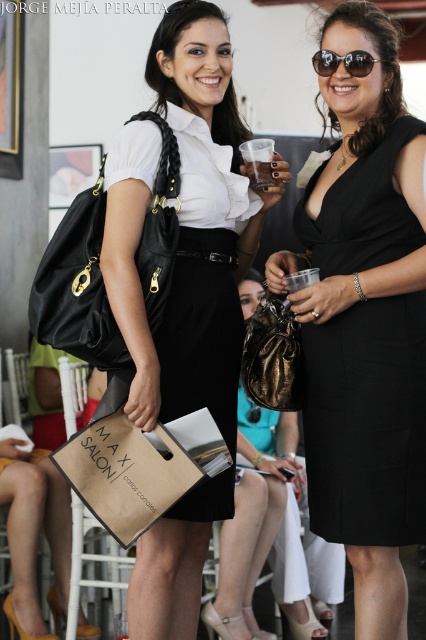
Question: Does black matte dress at center have a lesser width compared to bronze metallic bag at center?

Choices:
 (A) yes
 (B) no

Answer: (B)

Question: Can you confirm if black matte dress at center is thinner than black reflective sunglasses at upper center?

Choices:
 (A) no
 (B) yes

Answer: (A)

Question: Which object is the farthest from the bronze metallic bag at center?

Choices:
 (A) black leather bag at left
 (B) matte black bag at center

Answer: (A)

Question: Among these points, which one is nearest to the camera?

Choices:
 (A) (143, 209)
 (B) (351, 52)
 (C) (391, 307)

Answer: (C)

Question: Based on their relative distances, which object is nearer to the black reflective sunglasses at upper center?

Choices:
 (A) bronze metallic bag at center
 (B) black matte dress at center
 (C) matte black bag at center

Answer: (C)

Question: Is black matte dress at center behind black reflective sunglasses at upper center?

Choices:
 (A) yes
 (B) no

Answer: (B)